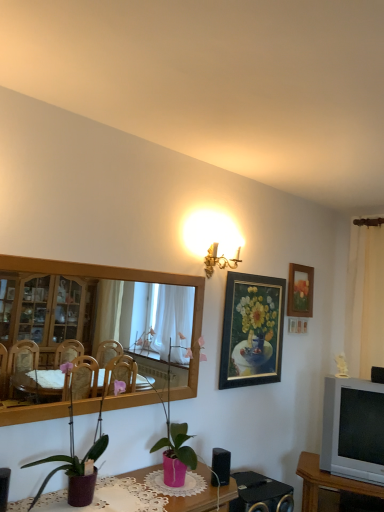
Question: In terms of size, does matte pink vase at lower center, which appears as the 1th table when viewed from the top, appear bigger or smaller than silver metallic television at right?

Choices:
 (A) big
 (B) small

Answer: (B)

Question: Is point (140, 493) positioned closer to the camera than point (342, 439)?

Choices:
 (A) closer
 (B) farther

Answer: (A)

Question: Estimate the real-world distances between objects in this image. Which object is farther from the wooden tv stand at lower right, the 2th table from the top?

Choices:
 (A) gold metallic wall sconce at upper center
 (B) white fabric curtain at right
 (C) wooden picture frame at upper right, marked as the first picture frame in a right-to-left arrangement
 (D) wooden mirror at upper left
 (E) black plastic speaker at lower right, marked as the 2th speaker in a left-to-right arrangement

Answer: (D)

Question: Based on their relative distances, which object is nearer to the black plastic speaker at lower right, the first speaker in the top-to-bottom sequence?

Choices:
 (A) gold metallic wall sconce at upper center
 (B) silver metallic television at right
 (C) gold-framed painting at upper right, acting as the 2th picture frame starting from the right
 (D) matte pink vase at lower center, which appears as the second table when viewed from the back
 (E) white fabric curtain at right

Answer: (B)